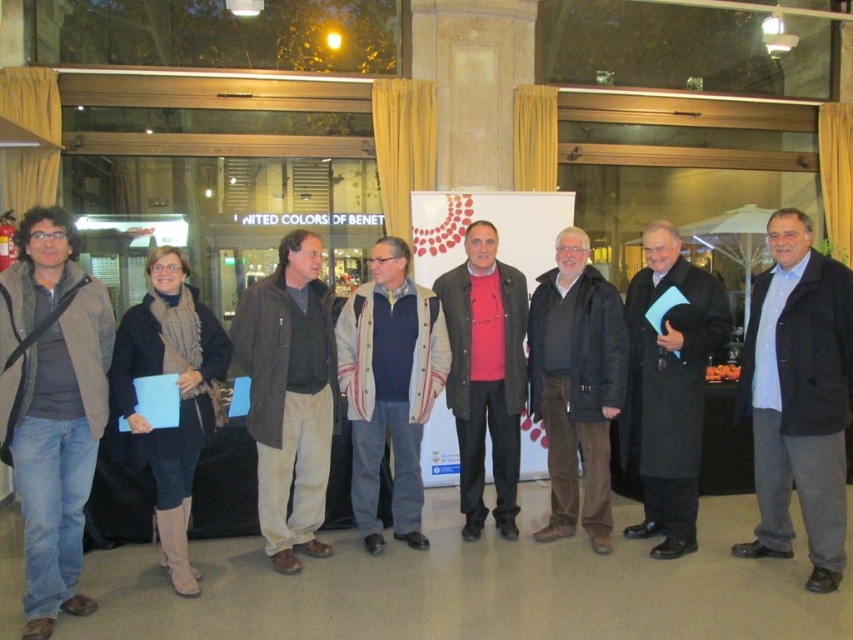
What do you see at coordinates (668, 388) in the screenshot?
I see `black wool coat at center` at bounding box center [668, 388].

Does black wool coat at center have a larger size compared to knitted wool sweater at center?

Correct, black wool coat at center is larger in size than knitted wool sweater at center.

Is point (724, 305) closer to camera compared to point (367, 497)?

Yes.

Where is `black wool coat at center`? The image size is (853, 640). black wool coat at center is located at coordinates (668, 388).

Is black wool coat at center above pink matte sweater at center?

No.

Between black wool coat at center and pink matte sweater at center, which one has more height?

With more height is pink matte sweater at center.

Locate an element on the screen. This screenshot has width=853, height=640. black wool coat at center is located at coordinates (668, 388).

At what (x,y) coordinates should I click in order to perform the action: click on black wool coat at center. Please return your answer as a coordinate pair (x, y). This screenshot has width=853, height=640. Looking at the image, I should click on [x=668, y=388].

This screenshot has height=640, width=853. What do you see at coordinates (798, 397) in the screenshot?
I see `blue cotton shirt at center` at bounding box center [798, 397].

Who is positioned more to the right, blue cotton shirt at center or brown corduroy jacket at center?

blue cotton shirt at center

Who is more forward, (x=846, y=280) or (x=260, y=346)?

Positioned in front is point (x=846, y=280).

At what (x,y) coordinates should I click in order to perform the action: click on blue cotton shirt at center. Please return your answer as a coordinate pair (x, y). Looking at the image, I should click on (798, 397).